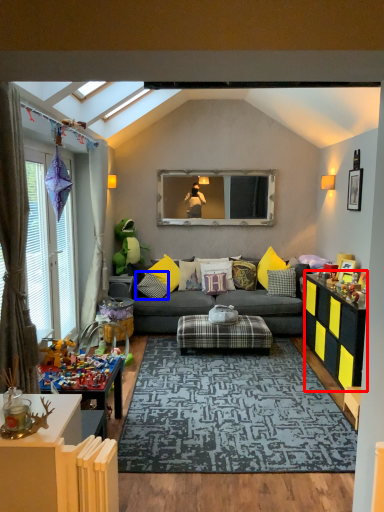
Question: Which of the following is the farthest to the observer, dresser (highlighted by a red box) or pillow (highlighted by a blue box)?

Choices:
 (A) dresser
 (B) pillow

Answer: (B)